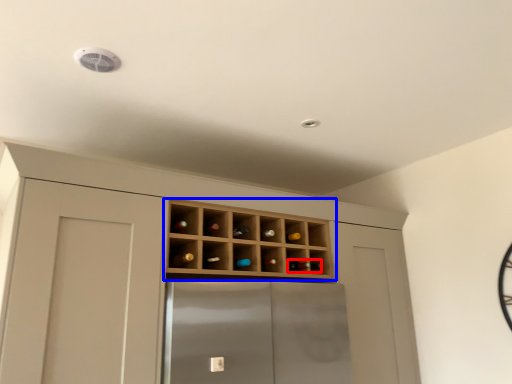
Question: Which of the following is the farthest to the observer, wine bottle (highlighted by a red box) or shelf (highlighted by a blue box)?

Choices:
 (A) wine bottle
 (B) shelf

Answer: (A)